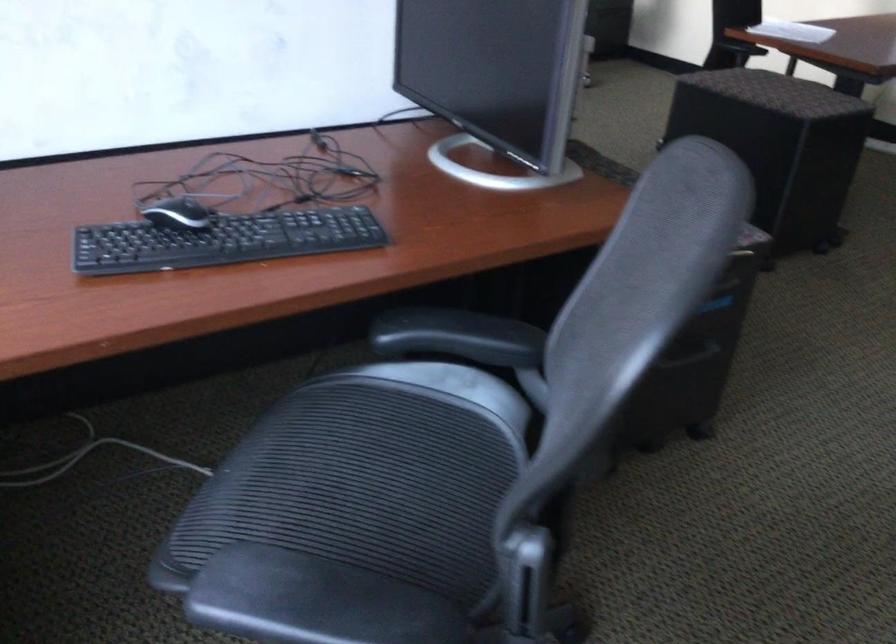
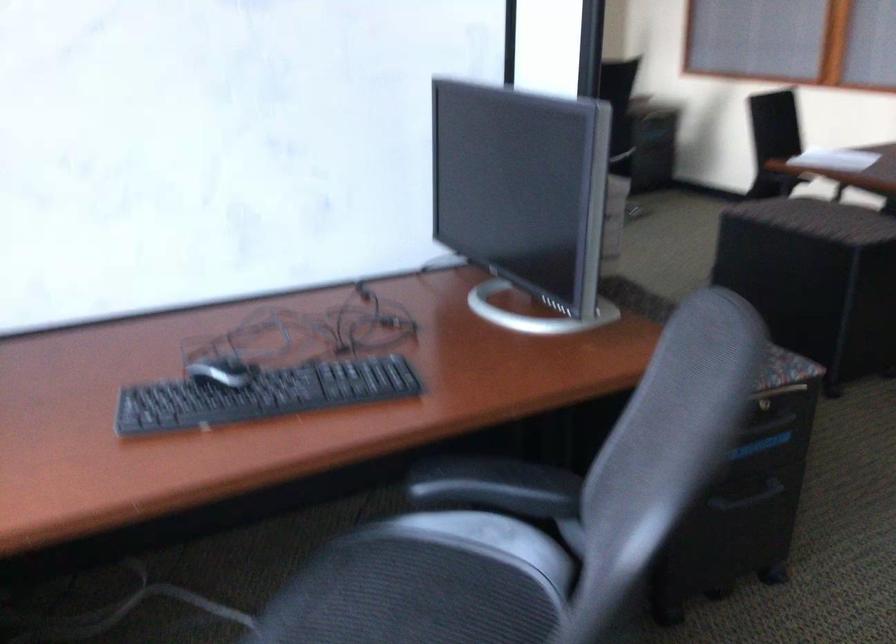
Where in the second image is the point corresponding to (685,357) from the first image?

(747, 497)